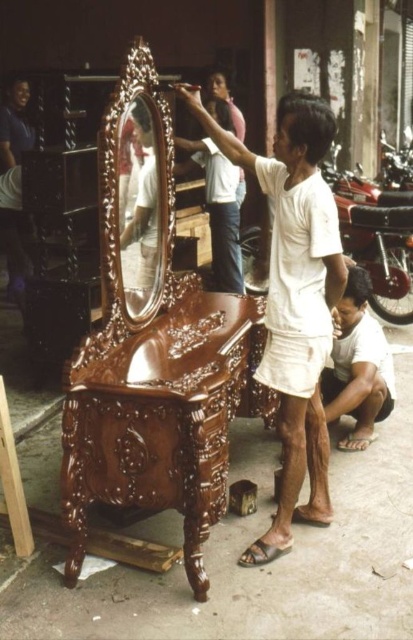
Question: Can you confirm if shiny brown wood vanity at center is positioned above light brown skin at lower right?

Choices:
 (A) yes
 (B) no

Answer: (B)

Question: Which point appears farthest from the camera in this image?

Choices:
 (A) (365, 440)
 (B) (128, 296)
 (C) (125, 442)
 (D) (294, 477)

Answer: (A)

Question: Which point is closer to the camera?

Choices:
 (A) (356, 304)
 (B) (223, 163)
 (C) (121, 349)

Answer: (C)

Question: Does white cotton shirt at center have a lesser width compared to polished wood mirror at center?

Choices:
 (A) no
 (B) yes

Answer: (A)

Question: Does white cotton shirt at center come in front of polished wood mirror at center?

Choices:
 (A) no
 (B) yes

Answer: (B)

Question: Based on their relative distances, which object is nearer to the shiny brown wood vanity at center?

Choices:
 (A) light brown skin at lower right
 (B) polished wood mirror at center
 (C) matte brown wooden man at center
 (D) white cotton shirt at center

Answer: (B)